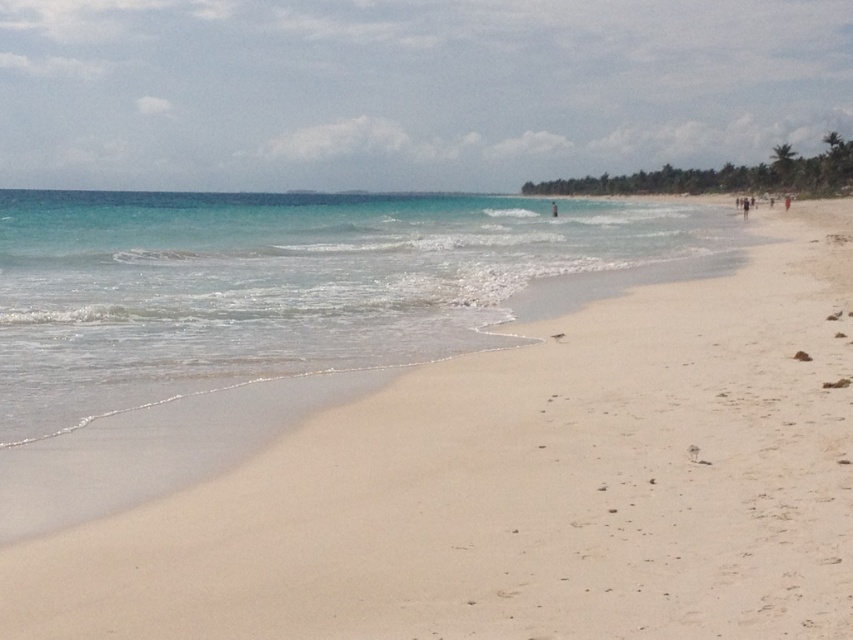
Question: Does white sand at center have a greater width compared to light blue fabric person at center?

Choices:
 (A) no
 (B) yes

Answer: (B)

Question: Where is clear blue water at center located in relation to light blue fabric person at center in the image?

Choices:
 (A) right
 (B) left

Answer: (B)

Question: Among these points, which one is farthest from the camera?

Choices:
 (A) (146, 397)
 (B) (612, 538)
 (C) (552, 212)

Answer: (C)

Question: Which of the following is the farthest from the observer?

Choices:
 (A) (259, 301)
 (B) (553, 214)
 (C) (456, 488)

Answer: (B)

Question: In this image, where is white sand at center located relative to clear blue water at center?

Choices:
 (A) below
 (B) above

Answer: (A)

Question: Estimate the real-world distances between objects in this image. Which object is farther from the light blue fabric person at center?

Choices:
 (A) clear blue water at center
 (B) white sand at center

Answer: (B)